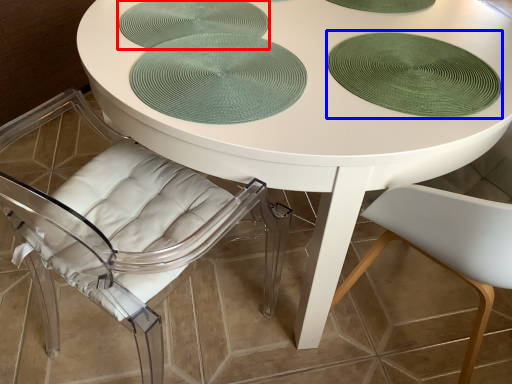
Question: Which of the following is the closest to the observer, glass plate (highlighted by a red box) or glass plate (highlighted by a blue box)?

Choices:
 (A) glass plate
 (B) glass plate

Answer: (B)